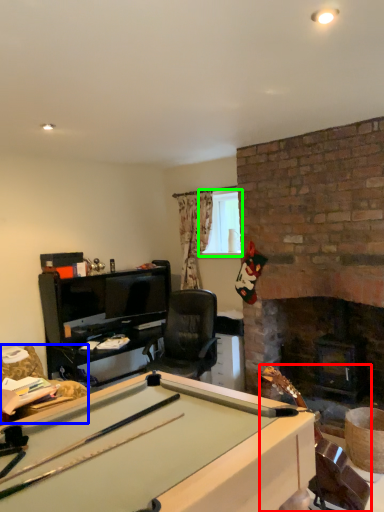
Question: Considering the real-world distances, which object is farthest from equipment (highlighted by a red box)? swivel chair (highlighted by a blue box) or window screen (highlighted by a green box)?

Choices:
 (A) swivel chair
 (B) window screen

Answer: (B)